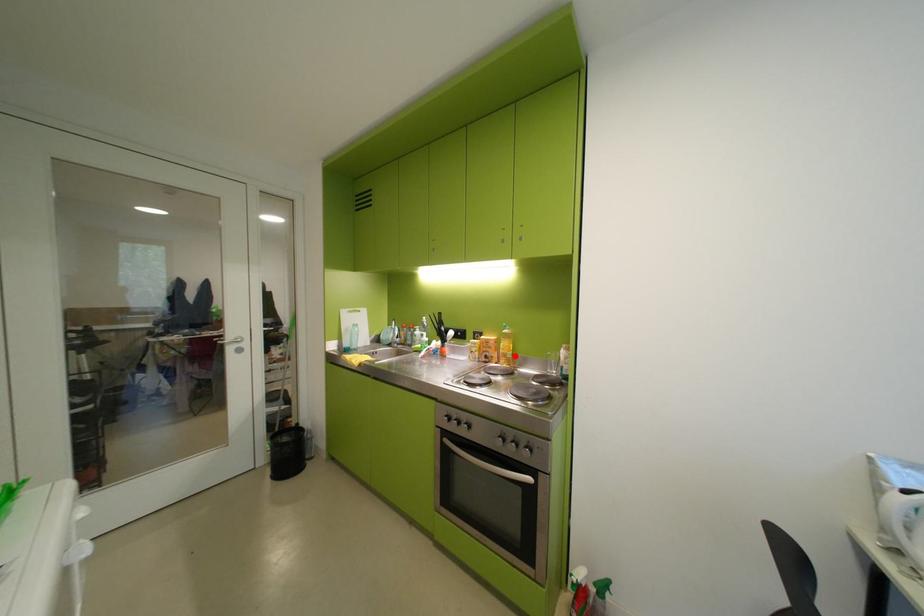
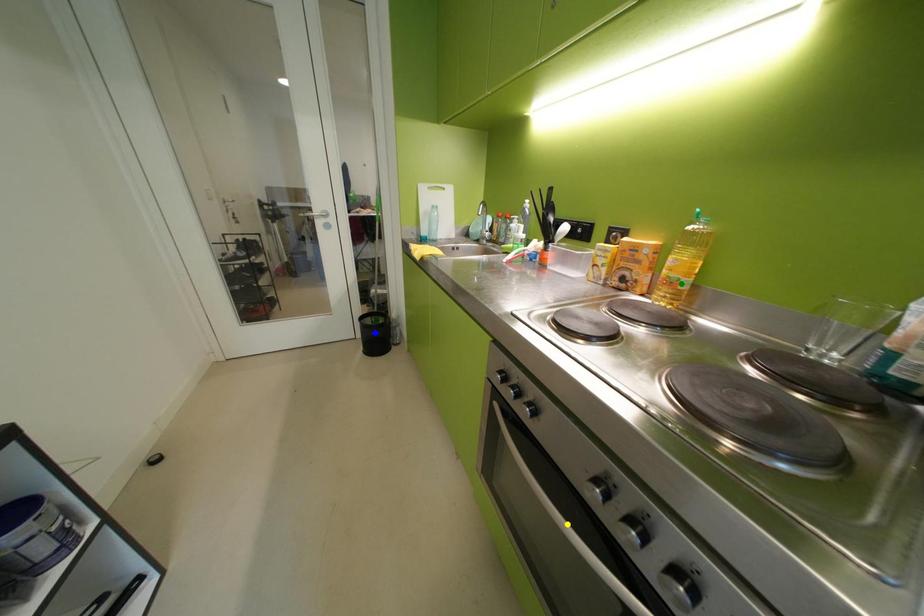
Question: I am providing you with two images of the same scene from different viewpoints. A red point is marked on the first image. You are given multiple points on the second image. Which mark in image 2 goes with the point in image 1?

Choices:
 (A) blue point
 (B) green point
 (C) yellow point

Answer: (B)